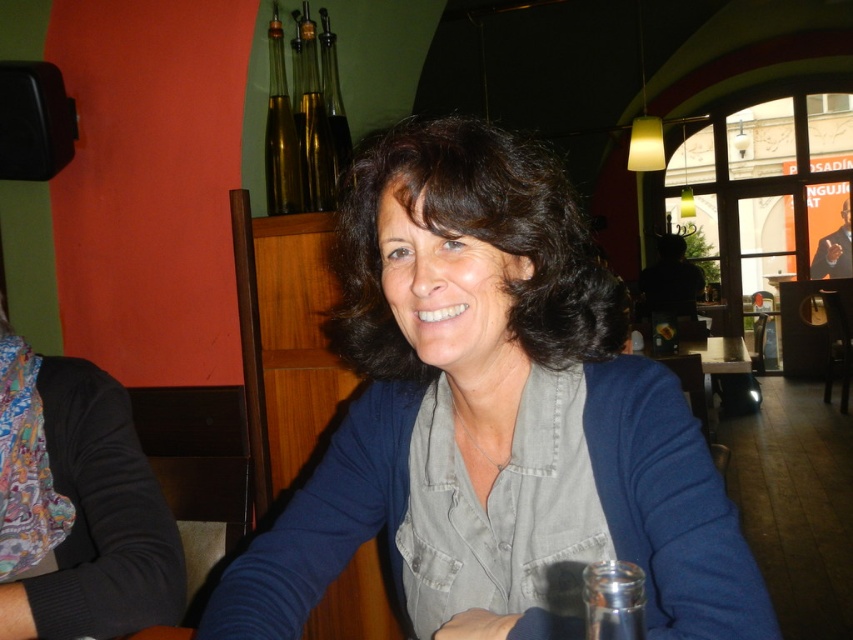
In the scene shown: You are a fashion designer observing the matte blue sweater at center in the image. If your measuring tape can extend up to 20 inches, can you reach the sweater to measure its sleeve length?

The distance between the matte blue sweater at center and the viewer is 21.62 inches, which is beyond the 20 inches limit of the measuring tape. Therefore, you cannot reach the sweater to measure its sleeve length.

You are a photographer setting up a shot of the woman at the table. You want to ensure both the printed fabric scarf at left and the transparent glass at lower right are in focus. Since you can only focus on one object, which one should you choose to ensure the other is also in focus?

The printed fabric scarf at left is positioned on the left side of transparent glass at lower right. Since they are close to each other spatially, focusing on one should keep the other in focus as well.